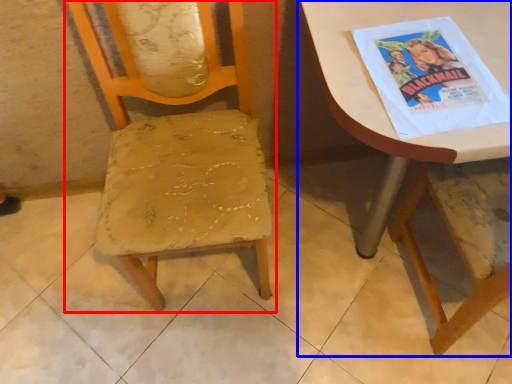
Question: Which of the following is the farthest to the observer, chair (highlighted by a red box) or table (highlighted by a blue box)?

Choices:
 (A) chair
 (B) table

Answer: (B)